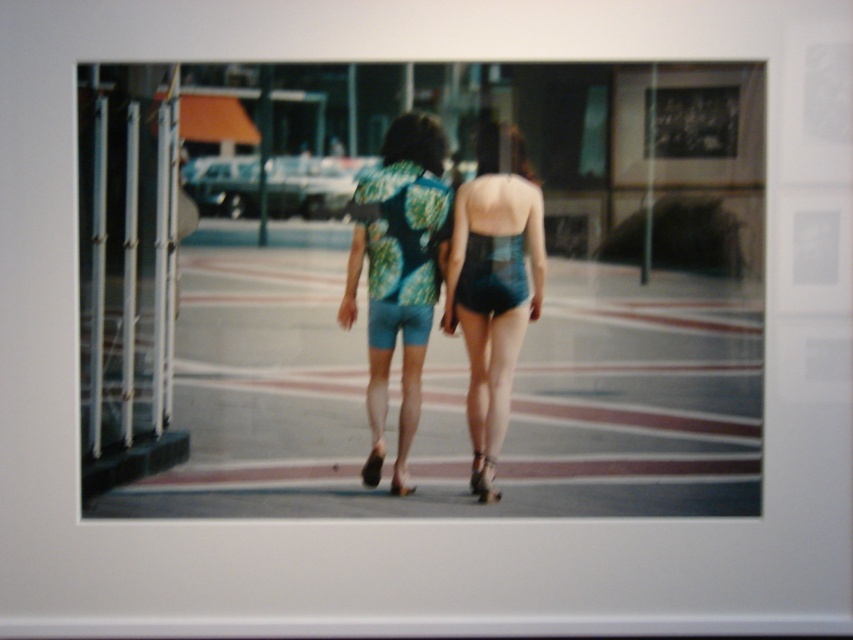
Question: Which point is farther to the camera?

Choices:
 (A) (471, 316)
 (B) (421, 349)
 (C) (351, 200)

Answer: (B)

Question: Which is nearer to the teal fabric shorts at center?

Choices:
 (A) green floral fabric dress at center
 (B) teal satin shorts at center

Answer: (A)

Question: Does teal fabric shorts at center have a greater width compared to green floral fabric dress at center?

Choices:
 (A) yes
 (B) no

Answer: (B)

Question: Considering the real-world distances, which object is closest to the teal satin shorts at center?

Choices:
 (A) green floral fabric dress at center
 (B) teal fabric shorts at center

Answer: (A)

Question: Can you confirm if teal satin shorts at center is wider than teal fabric shorts at center?

Choices:
 (A) no
 (B) yes

Answer: (B)

Question: Can you confirm if teal fabric shorts at center is bigger than green floral fabric dress at center?

Choices:
 (A) yes
 (B) no

Answer: (A)